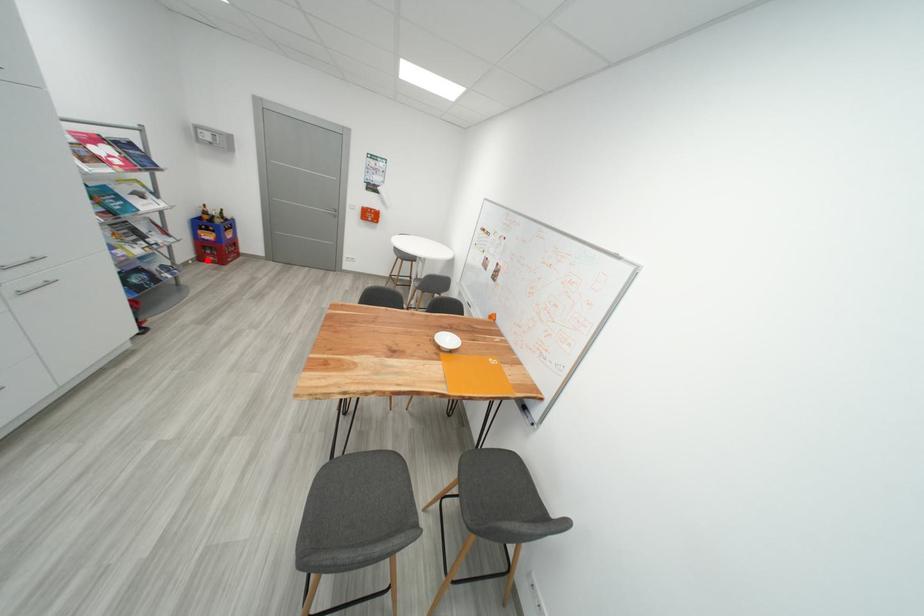
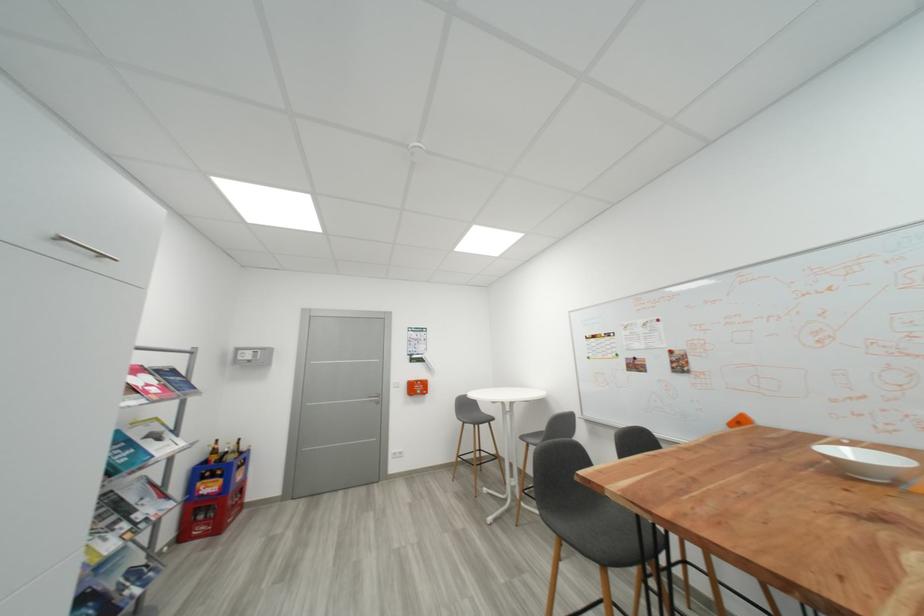
In the second image, find the point that corresponds to the highlighted location in the first image.

(189, 538)